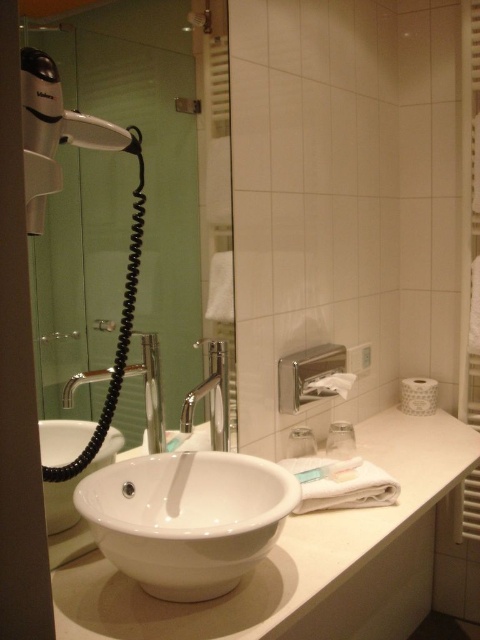
You are a maintenance worker who needs to check the camera mounted on the wall. The camera is 35.81 inches away from the white glossy sink at center. If your arm reaches 32 inches, can you comfortably reach the camera without moving the sink?

The camera is 35.81 inches away from the white glossy sink at center. Since your arm only reaches 32 inches, you cannot comfortably reach the camera without moving the sink.

You need to place a decorative item between the white glossy sink at center and the silver metallic faucet at left. Given their sizes, which object should the item be placed closer to?

The white glossy sink at center is bigger than the silver metallic faucet at left, so the decorative item should be placed closer to the silver metallic faucet at left to maintain balance.